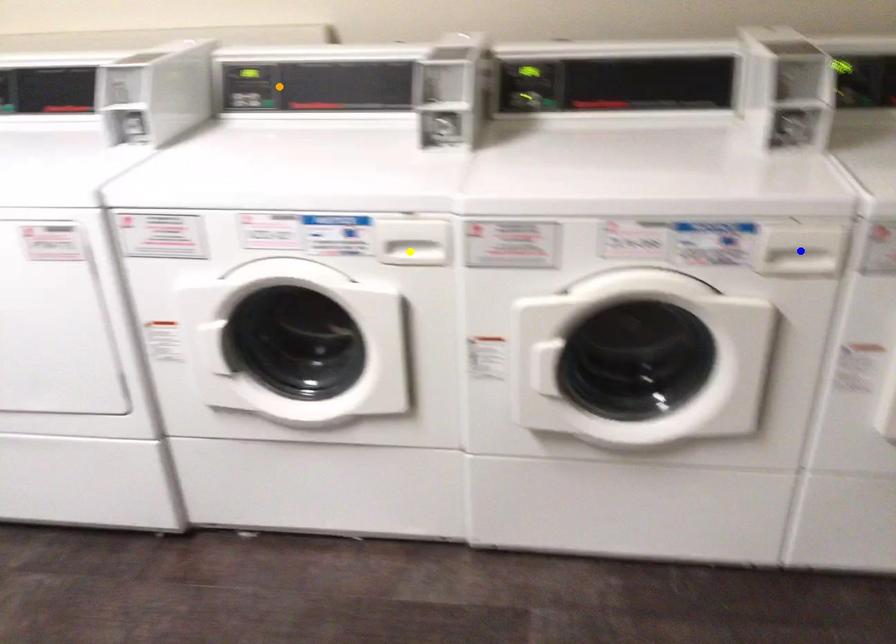
Order these from nearest to farthest:
blue point | yellow point | orange point

blue point
yellow point
orange point